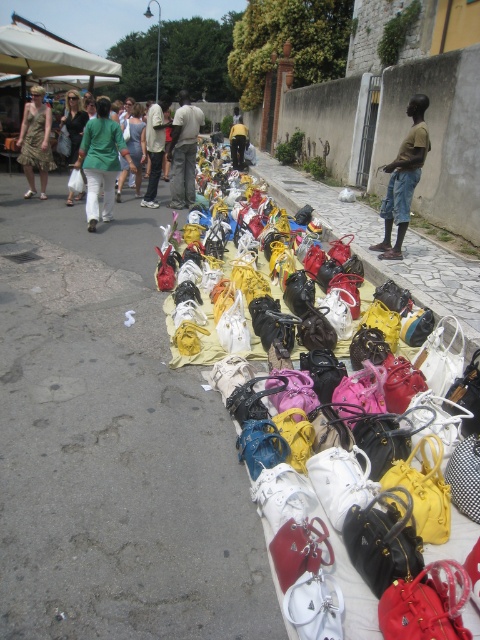
What do you see at coordinates (155, 147) in the screenshot? This screenshot has height=640, width=480. I see `light brown leather shirt at center` at bounding box center [155, 147].

Who is more forward, (159, 157) or (242, 161)?

Point (159, 157) is more forward.

The image size is (480, 640). What are the coordinates of `light brown leather shirt at center` in the screenshot? It's located at (155, 147).

Who is shorter, brown matte shirt at center or matte black bag at center?

With less height is brown matte shirt at center.

Describe the element at coordinates (404, 179) in the screenshot. This screenshot has width=480, height=640. I see `brown matte shirt at center` at that location.

Is point (397, 163) closer to viewer compared to point (235, 156)?

Yes, point (397, 163) is in front of point (235, 156).

This screenshot has width=480, height=640. I want to click on brown matte shirt at center, so click(x=404, y=179).

Can you confirm if brown matte shirt at center is wider than matte green dress at left?

In fact, brown matte shirt at center might be narrower than matte green dress at left.

Is point (386, 227) more distant than point (43, 170)?

No, it is not.

At what (x,y) coordinates should I click in order to perform the action: click on brown matte shirt at center. Please return your answer as a coordinate pair (x, y). This screenshot has width=480, height=640. Looking at the image, I should click on (404, 179).